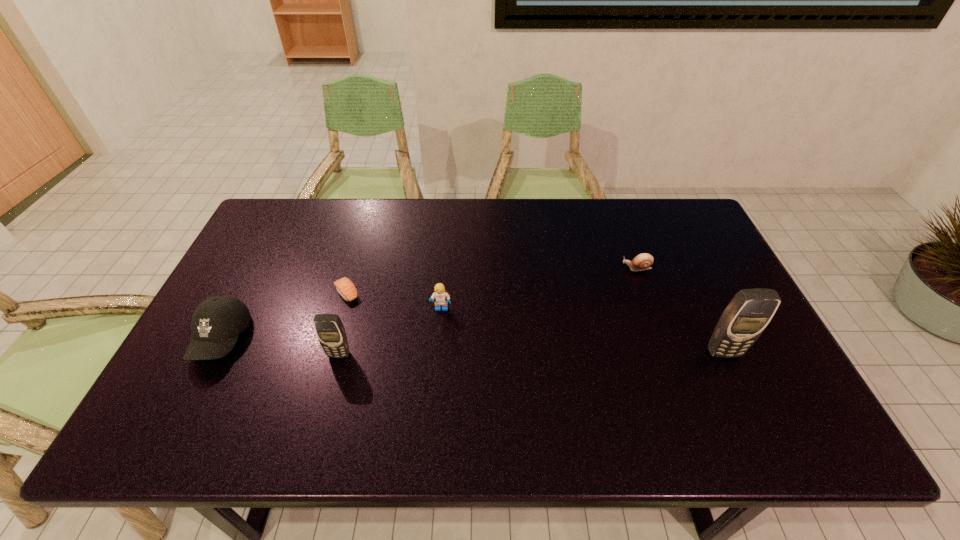
This screenshot has width=960, height=540. In order to click on vacant region between the shortest object and the fourth object from left to right in this screenshot , I will do `click(394, 301)`.

Locate an element on the screen. The width and height of the screenshot is (960, 540). free space between the baseball cap and the shorter cellular telephone is located at coordinates (280, 347).

Where is `vacant space that is in between the shortest object and the leftmost object`? vacant space that is in between the shortest object and the leftmost object is located at coordinates tap(284, 316).

Where is `free space between the taller cellular telephone and the baseball cap`? The width and height of the screenshot is (960, 540). free space between the taller cellular telephone and the baseball cap is located at coordinates (472, 346).

Locate an element on the screen. vacant space in between the shortest object and the Lego is located at coordinates (394, 301).

Where is `vacant area that lies between the left cellular telephone and the fourth object from left to right`? This screenshot has width=960, height=540. vacant area that lies between the left cellular telephone and the fourth object from left to right is located at coordinates (391, 332).

Identify which object is located as the third nearest to the sushi. Please provide its 2D coordinates. Your answer should be formatted as a tuple, i.e. [(x, y)], where the tuple contains the x and y coordinates of a point satisfying the conditions above.

[(439, 294)]

You are a GUI agent. You are given a task and a screenshot of the screen. Output one action in this format:
    pyautogui.click(x=<x>, y=<y>)
    Task: Click on the object identified as the closest to the right cellular telephone
    This screenshot has width=960, height=540.
    Given the screenshot: What is the action you would take?
    pyautogui.click(x=643, y=261)

Where is `vacant region that satisfies the following two spatial constraints: 1. on the front-facing side of the second object from right to left; 2. on the front face of the second tallest object`? vacant region that satisfies the following two spatial constraints: 1. on the front-facing side of the second object from right to left; 2. on the front face of the second tallest object is located at coordinates (667, 354).

In order to click on free spot that satisfies the following two spatial constraints: 1. on the front-facing side of the fifth object from left to right; 2. on the front face of the left cellular telephone in this screenshot , I will do point(667,354).